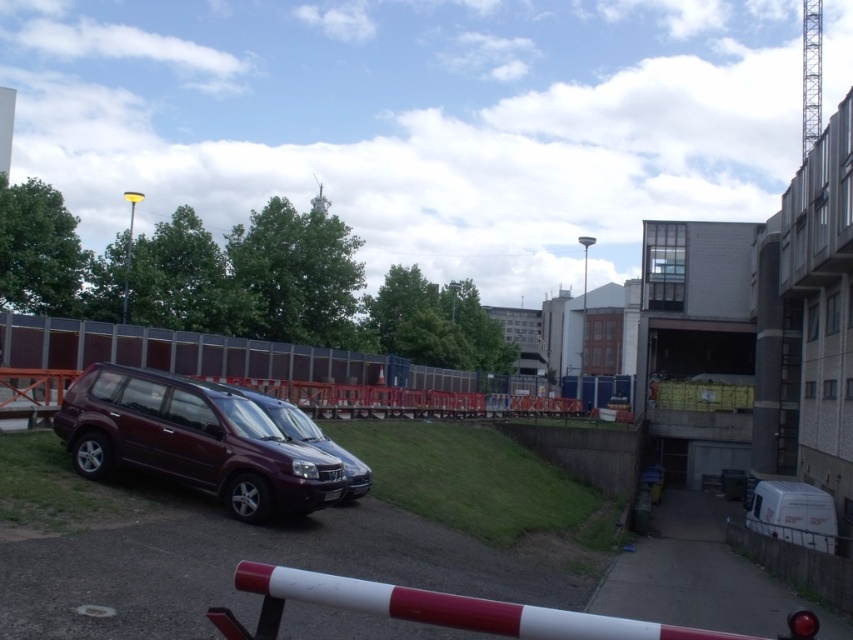
Looking at this image, you are a delivery driver who needs to park your vehicle in this area. You have a truck that is the same size as the maroon matte suv at left. There is a parking spot next to the satin purple suv at center. Can your truck fit into that parking spot?

The maroon matte suv at left is bigger than the satin purple suv at center. Since your truck is the same size as the maroon matte suv at left, it may not fit into the parking spot next to the satin purple suv at center, which is sized for smaller vehicles.

You are a delivery person trying to load a tall package into a vehicle. You have two options in the scene, the maroon matte suv at left and the satin purple suv at center. Which vehicle should you choose to ensure the package fits inside without exceeding the height limit?

The maroon matte suv at left has a greater height compared to the satin purple suv at center, so you should choose the maroon matte suv at left to ensure the tall package fits inside without exceeding the height limit.